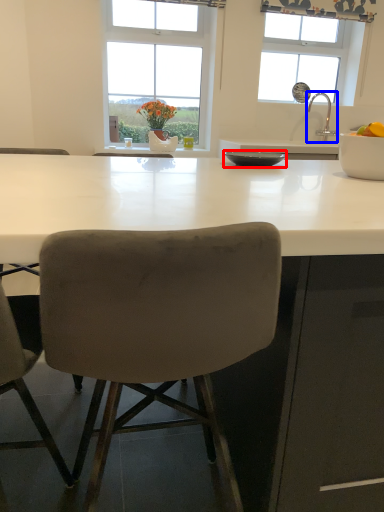
Question: Which of the following is the closest to the observer, bowl (highlighted by a red box) or tap (highlighted by a blue box)?

Choices:
 (A) bowl
 (B) tap

Answer: (A)